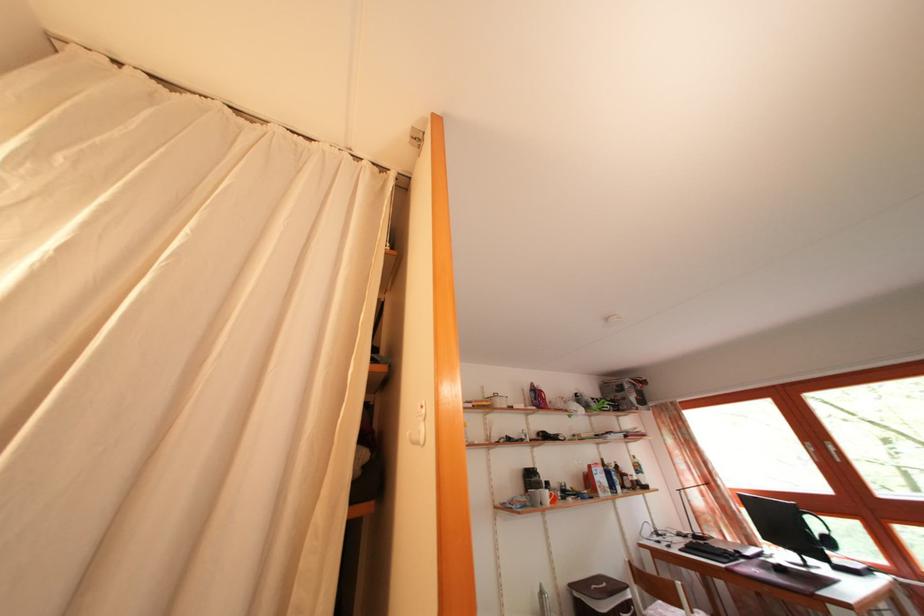
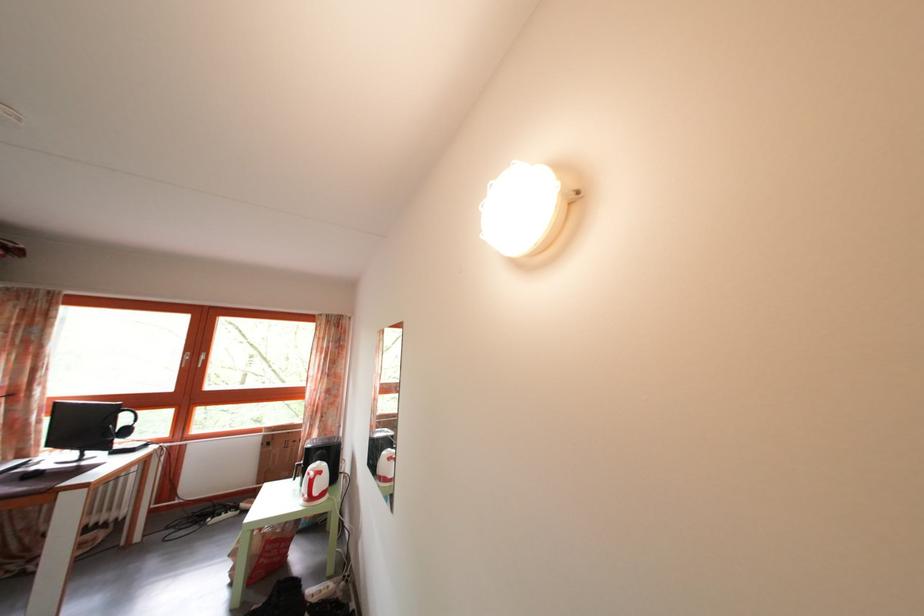
Question: The camera is either moving clockwise (left) or counter-clockwise (right) around the object. The first image is from the beginning of the video and the second image is from the end. Is the camera moving left or right when shooting the video?

Choices:
 (A) Left
 (B) Right

Answer: (A)